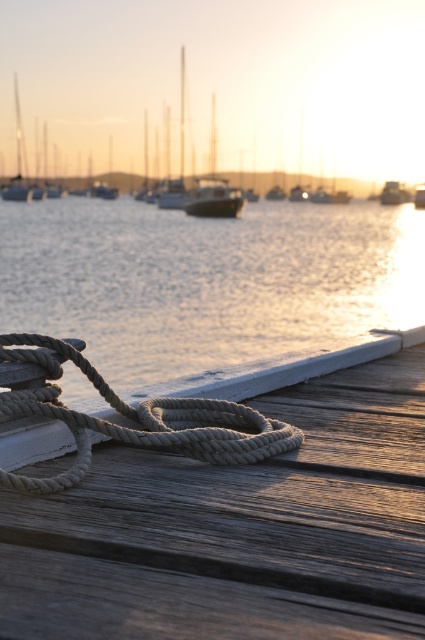
Does point (71, 323) lie behind point (146, 416)?

Yes, it is.

Which of these two, shiny silver water at center or natural beige rope at lower left, stands taller?

shiny silver water at center is taller.

Does point (192, 320) come behind point (133, 433)?

Yes, point (192, 320) is behind point (133, 433).

This screenshot has height=640, width=425. Identify the location of shiny silver water at center. (206, 280).

Is shiny silver water at center to the right of metallic silver boat at right from the viewer's perspective?

In fact, shiny silver water at center is to the left of metallic silver boat at right.

Between shiny silver water at center and metallic silver boat at right, which one has less height?

metallic silver boat at right

Describe the element at coordinates (206, 280) in the screenshot. Image resolution: width=425 pixels, height=640 pixels. I see `shiny silver water at center` at that location.

The height and width of the screenshot is (640, 425). Identify the location of shiny silver water at center. (206, 280).

Is shiny silver water at center shorter than metallic silver boat at center?

In fact, shiny silver water at center may be taller than metallic silver boat at center.

Does shiny silver water at center lie in front of metallic silver boat at center?

Yes, shiny silver water at center is closer to the viewer.

Locate an element on the screen. The width and height of the screenshot is (425, 640). shiny silver water at center is located at coordinates (206, 280).

At what (x,y) coordinates should I click in order to perform the action: click on shiny silver water at center. Please return your answer as a coordinate pair (x, y). The width and height of the screenshot is (425, 640). Looking at the image, I should click on (206, 280).